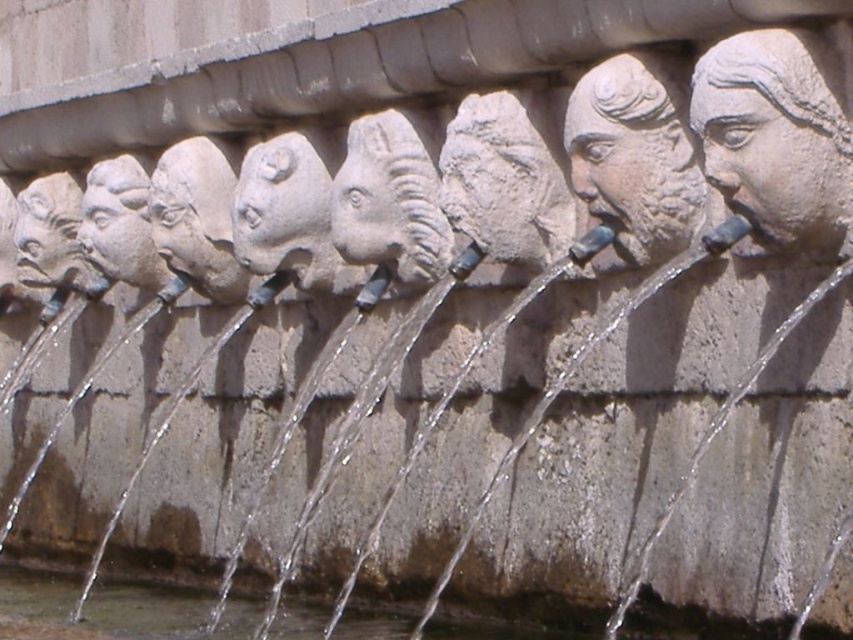
Which of these two, clear water at center or matte stone face at center, stands shorter?

Standing shorter between the two is clear water at center.

Is clear water at center closer to camera compared to matte stone face at center?

Yes.

Who is more forward, (x=630, y=636) or (x=155, y=179)?

Positioned in front is point (x=630, y=636).

Locate an element on the screen. clear water at center is located at coordinates (164, 611).

Which is in front, point (753, 634) or point (837, 124)?

Point (837, 124) is in front.

The width and height of the screenshot is (853, 640). What do you see at coordinates (164, 611) in the screenshot?
I see `clear water at center` at bounding box center [164, 611].

You are a GUI agent. You are given a task and a screenshot of the screen. Output one action in this format:
    pyautogui.click(x=<x>, y=<y>)
    Task: Click on the clear water at center
    This screenshot has height=640, width=853.
    Given the screenshot: What is the action you would take?
    pyautogui.click(x=164, y=611)

Who is positioned more to the right, matte stone horse head at center or matte stone face at center?

Positioned to the right is matte stone horse head at center.

Who is more distant from viewer, (419, 285) or (157, 205)?

Point (157, 205)

Where is `matte stone horse head at center`? This screenshot has width=853, height=640. matte stone horse head at center is located at coordinates (392, 198).